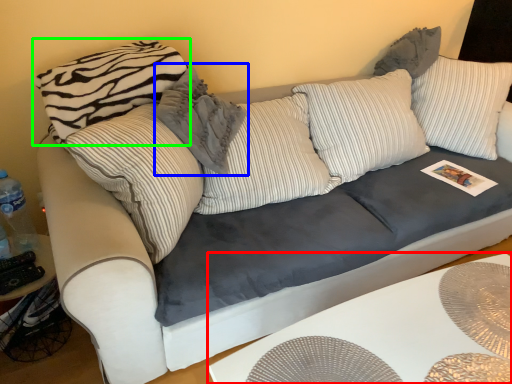
Question: Which is nearer to the table (highlighted by a red box)? pillow (highlighted by a blue box) or pillow (highlighted by a green box).

Choices:
 (A) pillow
 (B) pillow

Answer: (A)